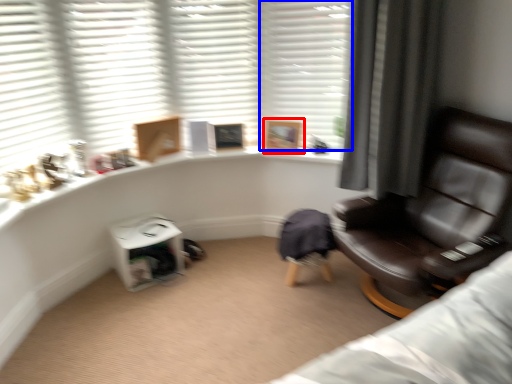
Question: Among these objects, which one is nearest to the camera, picture frame (highlighted by a red box) or shutter (highlighted by a blue box)?

Choices:
 (A) picture frame
 (B) shutter

Answer: (B)